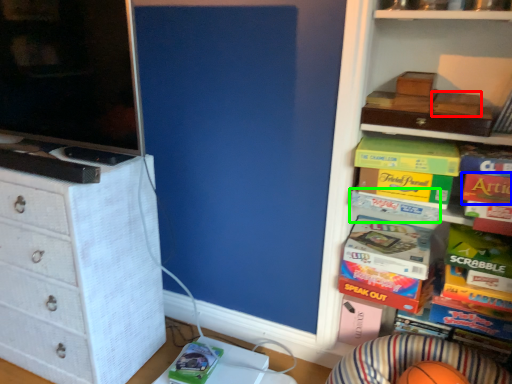
Question: Which is farther away from storage box (highlighted by a red box)? book (highlighted by a blue box) or book (highlighted by a green box)?

Choices:
 (A) book
 (B) book

Answer: (B)